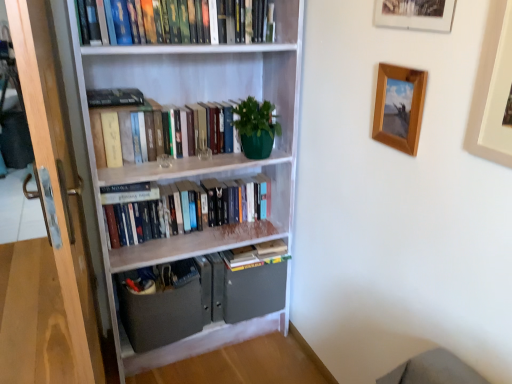
Locate an element on the screen. free space above hardcover books at center, which is the second book in bottom-to-top order (from a real-world perspective) is located at coordinates (183, 185).